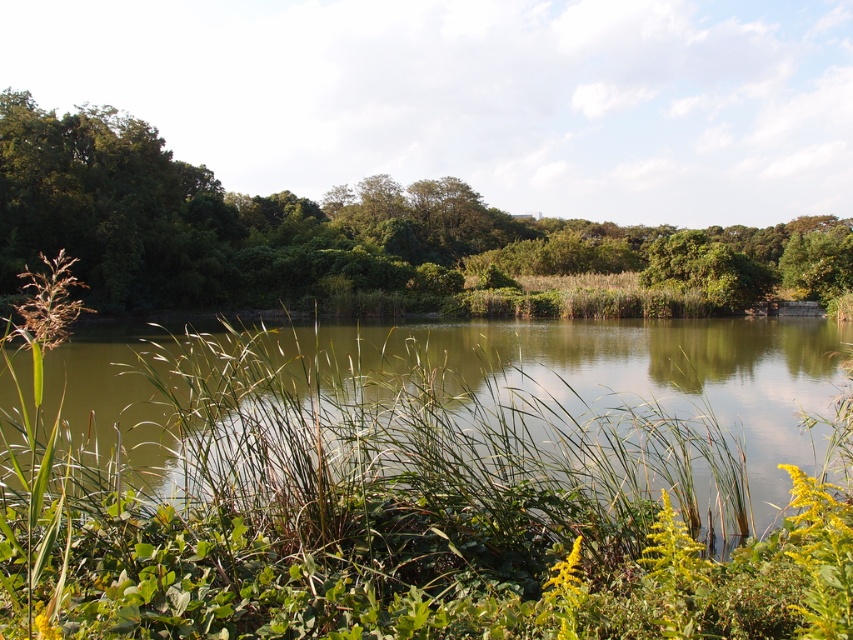
Is green grassy river at center in front of green leafy tree at center?

Yes, green grassy river at center is in front of green leafy tree at center.

Can you confirm if green grassy river at center is positioned below green leafy tree at center?

Yes, green grassy river at center is below green leafy tree at center.

Between point (747, 509) and point (648, 228), which one is positioned in front?

Point (747, 509) is more forward.

Where is `green grassy river at center`? green grassy river at center is located at coordinates (456, 413).